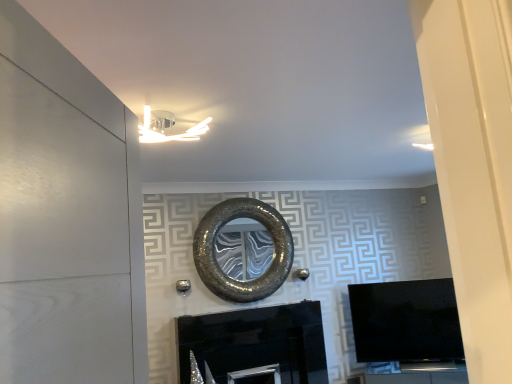
Question: Could you tell me if shiny metallic mirror at center is turned towards black glossy fireplace at center?

Choices:
 (A) yes
 (B) no

Answer: (B)

Question: Considering the relative sizes of shiny metallic mirror at center and black glossy fireplace at center in the image provided, is shiny metallic mirror at center smaller than black glossy fireplace at center?

Choices:
 (A) no
 (B) yes

Answer: (B)

Question: Does shiny metallic mirror at center have a larger size compared to black glossy fireplace at center?

Choices:
 (A) yes
 (B) no

Answer: (B)

Question: Is shiny metallic mirror at center to the left of black glossy fireplace at center from the viewer's perspective?

Choices:
 (A) yes
 (B) no

Answer: (A)

Question: Is shiny metallic mirror at center not within black glossy fireplace at center?

Choices:
 (A) no
 (B) yes

Answer: (B)

Question: Does point (218, 269) appear closer or farther from the camera than point (124, 367)?

Choices:
 (A) closer
 (B) farther

Answer: (B)

Question: From a real-world perspective, relative to white matte door at left, is shiny metallic mirror at center vertically above or below?

Choices:
 (A) above
 (B) below

Answer: (A)

Question: Looking at their shapes, would you say shiny metallic mirror at center is wider or thinner than white matte door at left?

Choices:
 (A) wide
 (B) thin

Answer: (B)

Question: From the image's perspective, relative to white matte door at left, is shiny metallic mirror at center above or below?

Choices:
 (A) below
 (B) above

Answer: (A)

Question: Is point (202, 273) closer or farther from the camera than point (417, 307)?

Choices:
 (A) closer
 (B) farther

Answer: (A)

Question: From a real-world perspective, is shiny metallic mirror at center physically located above or below black glossy tv at right?

Choices:
 (A) above
 (B) below

Answer: (A)

Question: In terms of size, does shiny metallic mirror at center appear bigger or smaller than black glossy tv at right?

Choices:
 (A) big
 (B) small

Answer: (B)

Question: From the image's perspective, relative to black glossy tv at right, is shiny metallic mirror at center above or below?

Choices:
 (A) above
 (B) below

Answer: (A)

Question: In terms of size, does white matte door at left appear bigger or smaller than black glossy tv at right?

Choices:
 (A) big
 (B) small

Answer: (B)

Question: In terms of width, does white matte door at left look wider or thinner when compared to black glossy tv at right?

Choices:
 (A) thin
 (B) wide

Answer: (A)